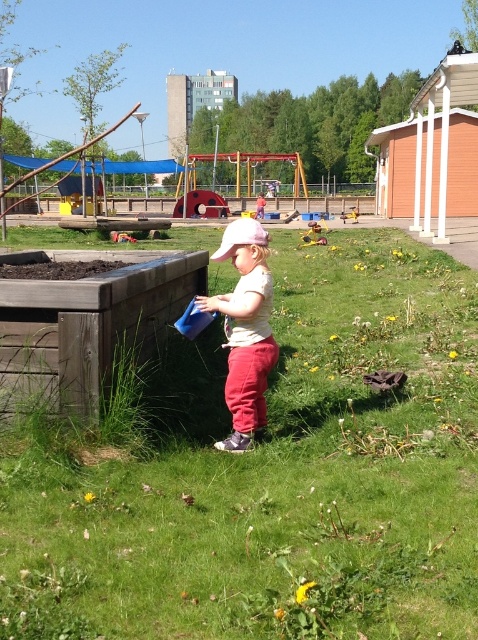
Question: Among these objects, which one is farthest from the camera?

Choices:
 (A) matte white shirt at center
 (B) green grass at center

Answer: (A)

Question: Is green grass at center above matte white shirt at center?

Choices:
 (A) no
 (B) yes

Answer: (B)

Question: Does green grass at center have a smaller size compared to matte white shirt at center?

Choices:
 (A) yes
 (B) no

Answer: (B)

Question: Is green grass at center below matte white shirt at center?

Choices:
 (A) no
 (B) yes

Answer: (A)